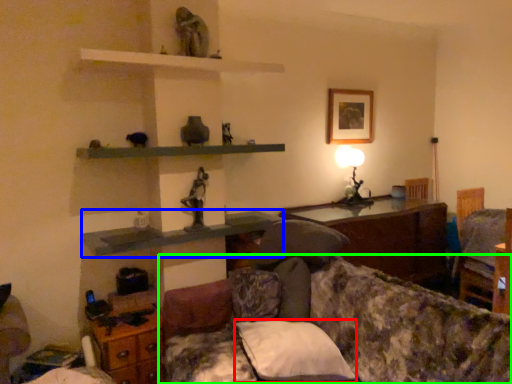
Question: Estimate the real-world distances between objects in this image. Which object is closer to pillow (highlighted by a red box), shelf (highlighted by a blue box) or studio couch (highlighted by a green box)?

Choices:
 (A) shelf
 (B) studio couch

Answer: (B)